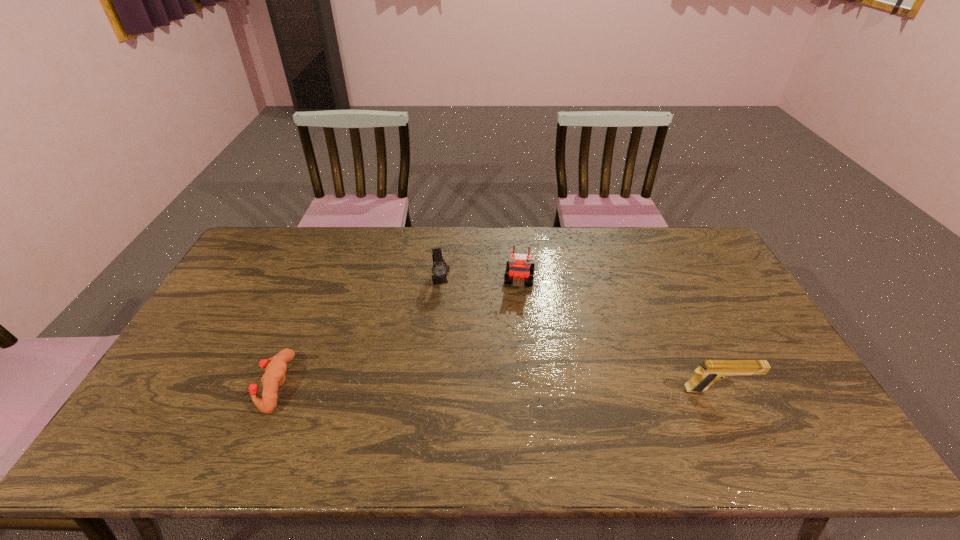
Image resolution: width=960 pixels, height=540 pixels. Find the location of `free region at the far edge of the desktop`. free region at the far edge of the desktop is located at coordinates (461, 240).

This screenshot has width=960, height=540. In order to click on vacant area at the near edge of the desktop in this screenshot , I will do `click(381, 391)`.

In the image, there is a desktop. Where is `vacant space at the left edge`? vacant space at the left edge is located at coordinates (241, 312).

You are a GUI agent. You are given a task and a screenshot of the screen. Output one action in this format:
    pyautogui.click(x=<x>, y=<y>)
    Task: Click on the free region at the right edge
    The height and width of the screenshot is (540, 960).
    Given the screenshot: What is the action you would take?
    pyautogui.click(x=744, y=386)

At what (x,y) coordinates should I click in order to perform the action: click on free space at the far left corner. Please return your answer as a coordinate pair (x, y). Image resolution: width=960 pixels, height=540 pixels. Looking at the image, I should click on (282, 249).

Identify the location of free space between the third object from right to left and the puncher. point(358,332).

The height and width of the screenshot is (540, 960). Find the location of `free space that is in between the rightmost object and the leftmost object`. free space that is in between the rightmost object and the leftmost object is located at coordinates (497, 387).

At what (x,y) coordinates should I click in order to perform the action: click on free space between the third object from left to right and the shortest object. Please return your answer as a coordinate pair (x, y). Image resolution: width=960 pixels, height=540 pixels. Looking at the image, I should click on (397, 332).

Image resolution: width=960 pixels, height=540 pixels. I want to click on free spot between the puncher and the watch, so [358, 332].

Locate an element on the screen. This screenshot has height=540, width=960. free space between the rightmost object and the third object from left to right is located at coordinates (619, 335).